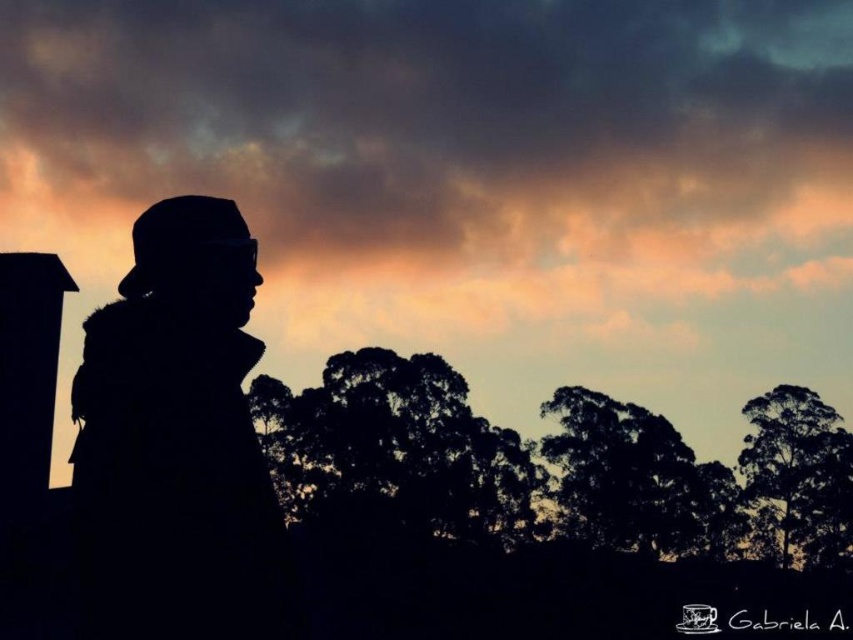
Does silhouette hat at left appear over silhouette tree at center?

Yes.

Can you confirm if silhouette hat at left is positioned below silhouette tree at center?

No, silhouette hat at left is not below silhouette tree at center.

I want to click on silhouette hat at left, so click(177, 444).

Where is `silhouette hat at left`? This screenshot has height=640, width=853. silhouette hat at left is located at coordinates (177, 444).

Which of these two, silhouette hat at left or silhouette tree at right, stands taller?

silhouette tree at right is taller.

Can you confirm if silhouette hat at left is bigger than silhouette tree at right?

No.

This screenshot has width=853, height=640. In order to click on silhouette hat at left in this screenshot , I will do `click(177, 444)`.

Does silhouette leafy tree at center come behind silhouette tree at center?

No, silhouette leafy tree at center is closer to the viewer.

Does silhouette leafy tree at center appear on the right side of silhouette tree at center?

No, silhouette leafy tree at center is not to the right of silhouette tree at center.

Which is in front, point (505, 532) or point (614, 460)?

Positioned in front is point (614, 460).

Where is `silhouette leafy tree at center`? The height and width of the screenshot is (640, 853). silhouette leafy tree at center is located at coordinates (395, 451).